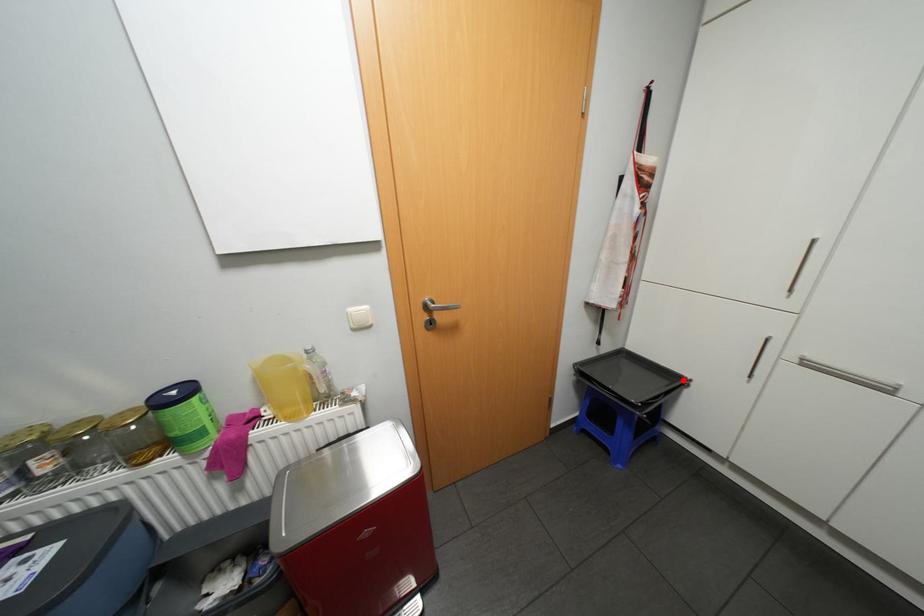
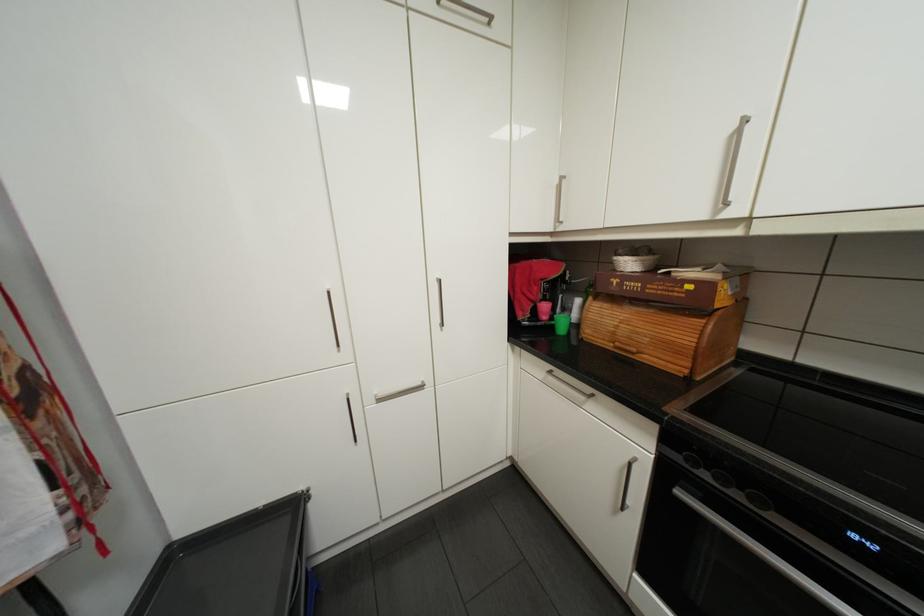
Locate, in the second image, the point that corresponds to the highlighted location in the first image.

(300, 507)